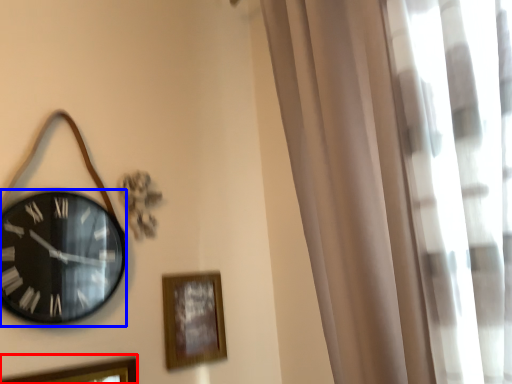
Question: Which object is closer to the camera taking this photo, picture frame (highlighted by a red box) or wall clock (highlighted by a blue box)?

Choices:
 (A) picture frame
 (B) wall clock

Answer: (A)